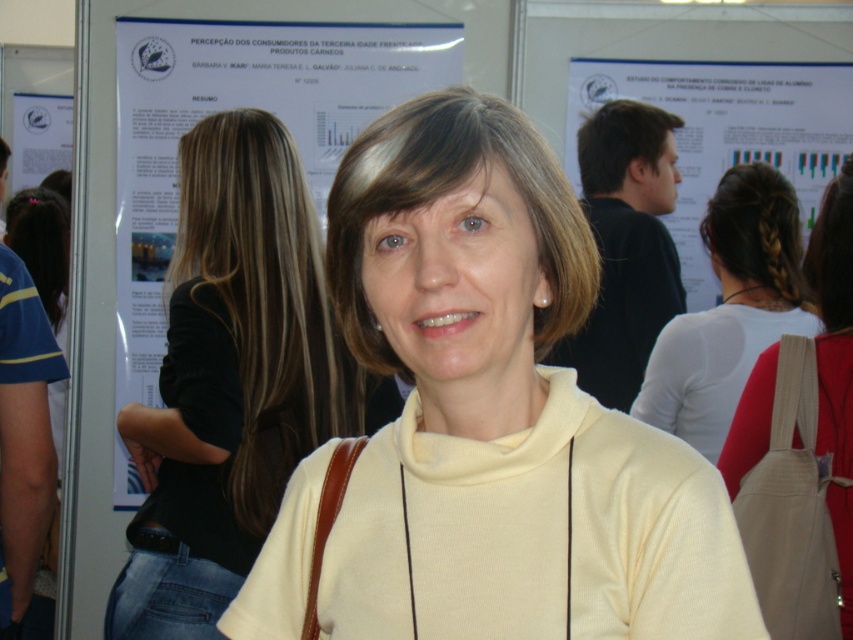
Question: Does brown smooth hair at upper center have a greater width compared to purple shiny hair at upper left?

Choices:
 (A) no
 (B) yes

Answer: (A)

Question: Which point is farther to the camera?

Choices:
 (A) dark brown hair at upper right
 (B) dark brown braided hair at upper right
 (C) white matte shirt at center

Answer: (A)

Question: Which is farther from the white paper at upper left?

Choices:
 (A) brown smooth hair at center
 (B) light yellow sweater at center

Answer: (A)

Question: Is brown smooth hair at center closer to camera compared to dark brown braided hair at upper right?

Choices:
 (A) yes
 (B) no

Answer: (A)

Question: Among these points, which one is farthest from the camera?

Choices:
 (A) (39, 220)
 (B) (799, 355)
 (C) (15, 92)
 (D) (828, 214)

Answer: (C)

Question: Does white matte shirt at center have a lesser width compared to white paper at upper left?

Choices:
 (A) yes
 (B) no

Answer: (B)